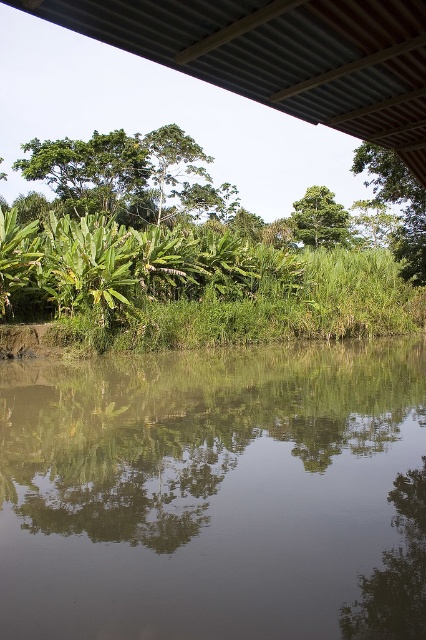
Is the position of green reflective water at center more distant than that of green leafy tree at upper right?

That is False.

Does green reflective water at center have a lesser width compared to green leafy tree at upper right?

Indeed, green reflective water at center has a lesser width compared to green leafy tree at upper right.

You are a GUI agent. You are given a task and a screenshot of the screen. Output one action in this format:
    pyautogui.click(x=<x>, y=<y>)
    Task: Click on the green reflective water at center
    The height and width of the screenshot is (640, 426).
    Given the screenshot: What is the action you would take?
    pyautogui.click(x=215, y=493)

Does point (279, 291) come farther from viewer compared to point (425, 236)?

No, (279, 291) is closer to viewer.

Describe the element at coordinates (195, 285) in the screenshot. I see `green leafy plants at center` at that location.

Is point (117, 257) in front of point (383, 186)?

Yes.

The height and width of the screenshot is (640, 426). I want to click on green leafy plants at center, so click(195, 285).

Who is taller, green reflective water at center or metallic corrugated roof at upper center?

With more height is green reflective water at center.

Who is higher up, green reflective water at center or metallic corrugated roof at upper center?

metallic corrugated roof at upper center is higher up.

Who is more forward, (389, 550) or (284, 6)?

Point (284, 6) is in front.

Locate an element on the screen. green reflective water at center is located at coordinates (215, 493).